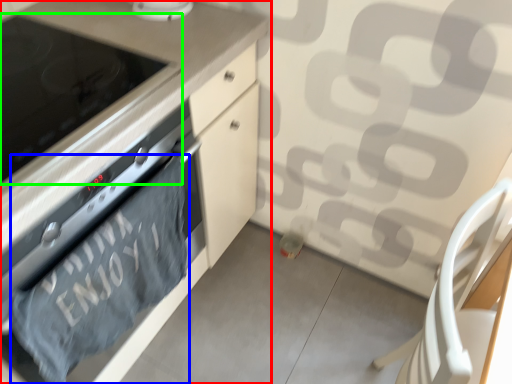
Question: Estimate the real-world distances between objects in this image. Which object is farther from cabinetry (highlighted by a red box), bath towel (highlighted by a blue box) or home appliance (highlighted by a green box)?

Choices:
 (A) bath towel
 (B) home appliance

Answer: (A)